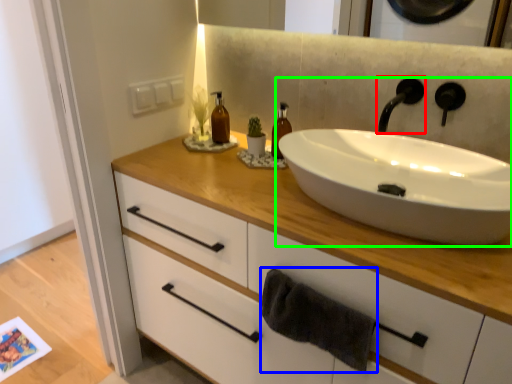
Question: Estimate the real-world distances between objects in this image. Which object is closer to tap (highlighted by a red box), bath towel (highlighted by a blue box) or sink (highlighted by a green box)?

Choices:
 (A) bath towel
 (B) sink

Answer: (B)